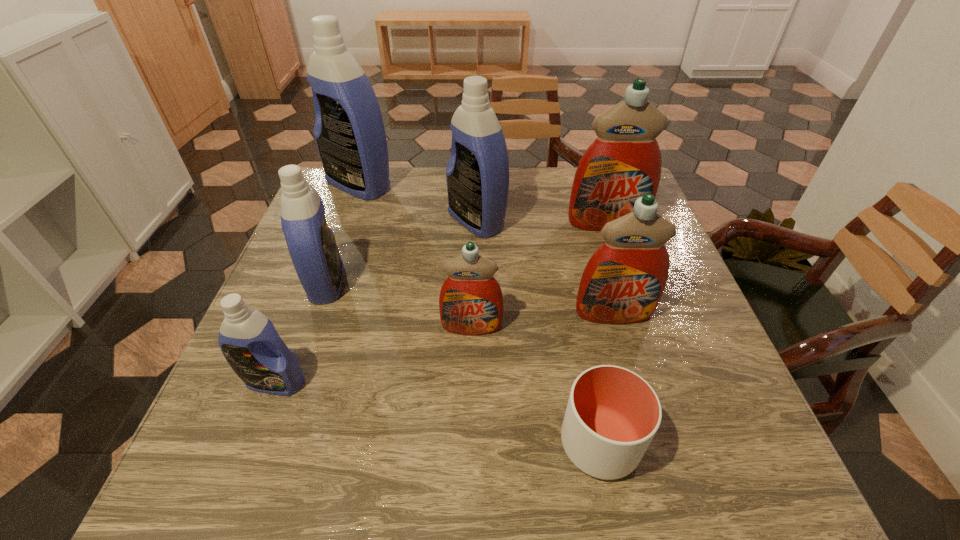
What are the coordinates of `vacant space that is in between the second nearest blue detergent and the nearest object` in the screenshot? It's located at (463, 363).

Where is `vacant point located between the rightmost blue detergent and the nearest object`? This screenshot has width=960, height=540. vacant point located between the rightmost blue detergent and the nearest object is located at coordinates (538, 332).

Where is `object identified as the sixth closest to the second smallest blue detergent`? This screenshot has width=960, height=540. object identified as the sixth closest to the second smallest blue detergent is located at coordinates (622, 283).

Point out which object is positioned as the second nearest to the biggest blue detergent. Please provide its 2D coordinates. Your answer should be formatted as a tuple, i.e. [(x, y)], where the tuple contains the x and y coordinates of a point satisfying the conditions above.

[(311, 243)]

Locate which detergent is the fourth closest to the second biggest red detergent. Please provide its 2D coordinates. Your answer should be formatted as a tuple, i.e. [(x, y)], where the tuple contains the x and y coordinates of a point satisfying the conditions above.

[(311, 243)]

At what (x,y) coordinates should I click in order to perform the action: click on detergent that stands as the second closest to the second smallest blue detergent. Please return your answer as a coordinate pair (x, y). This screenshot has height=540, width=960. Looking at the image, I should click on (471, 302).

Locate an element on the screen. The height and width of the screenshot is (540, 960). the third closest blue detergent to the leftmost red detergent is located at coordinates (248, 340).

I want to click on the second closest blue detergent to the biggest red detergent, so click(349, 131).

Locate which red detergent is the second closest to the cup. Please provide its 2D coordinates. Your answer should be formatted as a tuple, i.e. [(x, y)], where the tuple contains the x and y coordinates of a point satisfying the conditions above.

[(622, 283)]

Locate an element on the screen. The height and width of the screenshot is (540, 960). the second closest red detergent to the smallest red detergent is located at coordinates (624, 162).